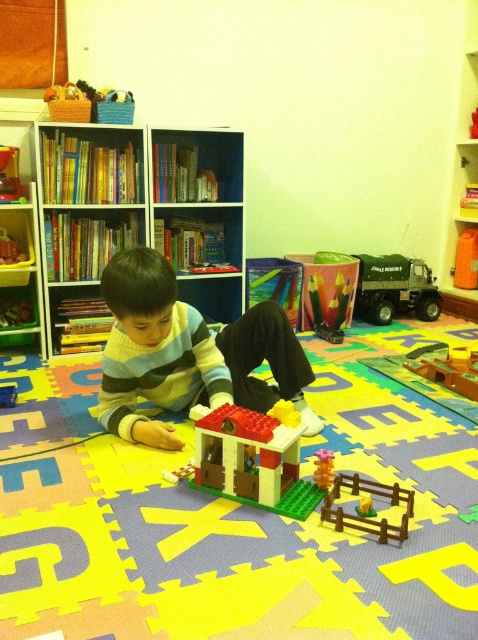
Consider the image. You are a robot trying to navigate to the brown wooden fence at lower center in the playroom. According to the coordinates provided, where exactly should you position yourself to reach it?

The brown wooden fence at lower center is located at point [362,516]. Position yourself at those coordinates to reach it.

Where is the striped sweater at center located in the image?

The striped sweater at center is located at point coordinates of (187, 353).

From the picture: You are standing in the playroom and want to reach a specific point marked at coordinates point (119,296). If your current distance from the camera is 4 feet, how much further do you need to move forward to reach that point?

The point (119,296) is 5.59 feet away from the camera. Since you are currently 4 feet away, you need to move forward an additional 1.59 feet to reach it.